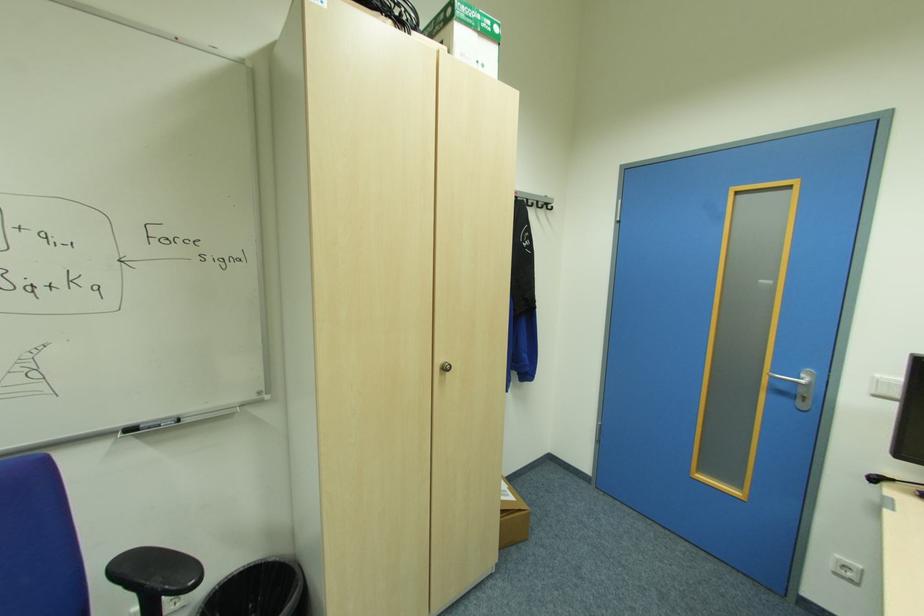
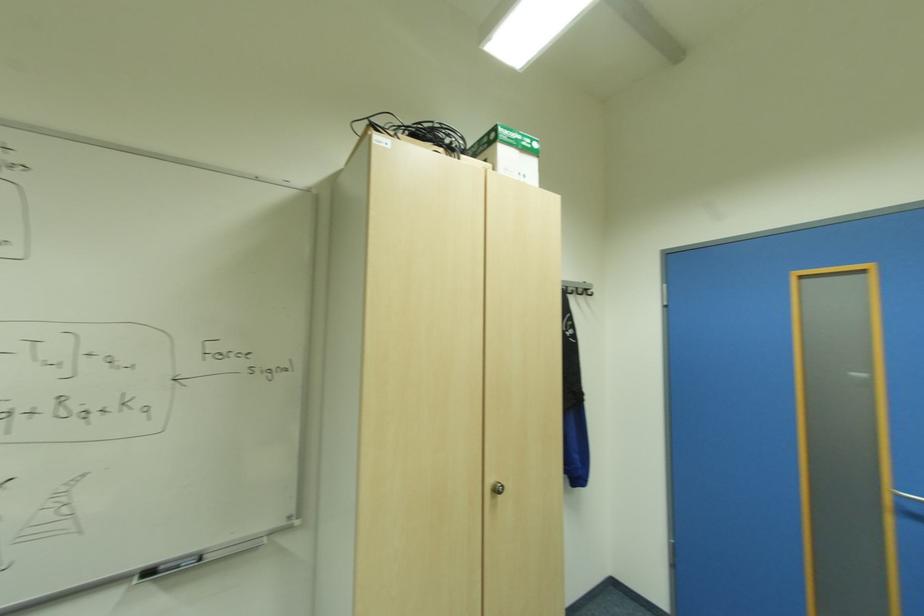
In the second image, find the point that corresponds to [549,204] in the first image.

(588, 291)